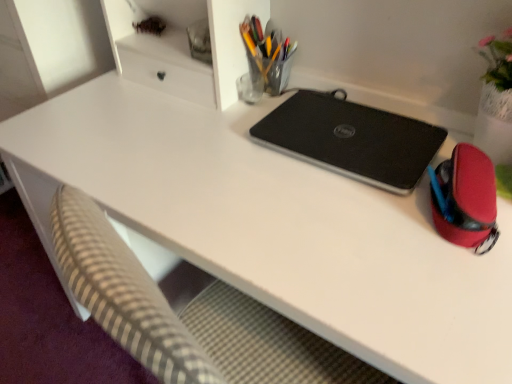
Identify the location of free space above black matte laptop at center (from a real-world perspective). Image resolution: width=512 pixels, height=384 pixels. (350, 125).